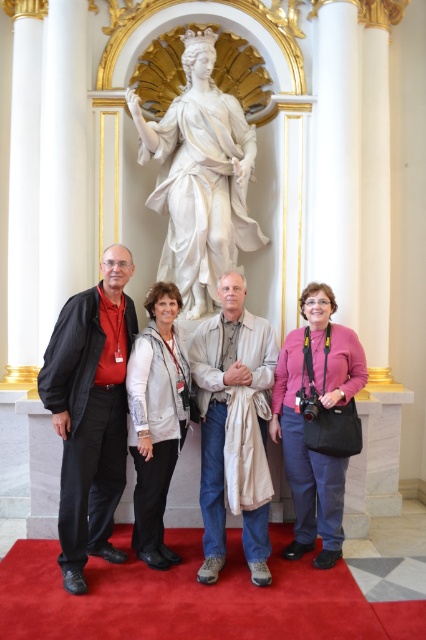
You are a photographer trying to adjust the lighting for a photo of the group. You need to ensure that the matte black jacket at left and the pink fabric purse at center are both well illuminated. Considering their sizes, which object requires a wider light source to cover it adequately?

The matte black jacket at left requires a wider light source because it has a greater height than the pink fabric purse at center, meaning it needs more coverage to be fully illuminated.

You are a photographer trying to capture a group photo in this setting. You need to ensure that the white marble statue at center and the light beige fabric draped over man at center are clearly visible in the frame. Given their distance apart, can you fit both into a single shot without zooming in or out?

The white marble statue at center and the light beige fabric draped over man at center are 4.50 feet apart from each other. Since they are only 4.50 feet apart, it should be possible to capture both in a single shot without needing to zoom, provided the camera is positioned appropriately to include both within the frame.

You are a photographer trying to adjust the lighting for a group photo. You notice the matte black jacket at left and the light beige fabric draped over man at center. Which object is located to the left of the other?

The matte black jacket at left is positioned on the left side of light beige fabric draped over man at center.